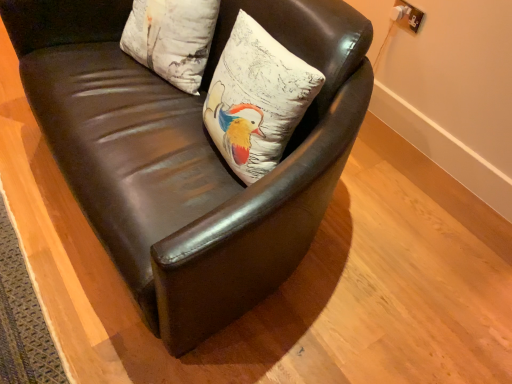
Image resolution: width=512 pixels, height=384 pixels. Describe the element at coordinates (188, 154) in the screenshot. I see `brown leather chair at center` at that location.

At what (x,y) coordinates should I click in order to perform the action: click on white matte pillow at center, the 1th pillow viewed from the right. Please return your answer as a coordinate pair (x, y). The width and height of the screenshot is (512, 384). Looking at the image, I should click on [257, 99].

Locate an element on the screen. The width and height of the screenshot is (512, 384). brown leather chair at center is located at coordinates (188, 154).

Is white matte pillow at center, which is the 2th pillow in left-to-right order, facing towards brown leather chair at center?

Yes.

Is white matte pillow at center, which is the 2th pillow in left-to-right order, inside the boundaries of brown leather chair at center, or outside?

white matte pillow at center, which is the 2th pillow in left-to-right order, is enclosed within brown leather chair at center.

From the image's perspective, is white matte pillow at center, which is the 2th pillow in left-to-right order, on brown leather chair at center?

No, from the image's perspective, white matte pillow at center, which is the 2th pillow in left-to-right order, is not above brown leather chair at center.

From a real-world perspective, relative to white textured pillow at upper center, marked as the 2th pillow in a right-to-left arrangement, is white matte pillow at center, the 1th pillow viewed from the right, vertically above or below?

Clearly, from a real-world perspective, white matte pillow at center, the 1th pillow viewed from the right, is above white textured pillow at upper center, marked as the 2th pillow in a right-to-left arrangement.

Identify the location of pillow lying in front of the white textured pillow at upper center, marked as the 2th pillow in a right-to-left arrangement. point(257,99).

Does brown leather chair at center have a greater height compared to white matte pillow at center, the 1th pillow viewed from the right?

Yes.

From the image's perspective, who appears lower, brown leather chair at center or white matte pillow at center, which is the 2th pillow in left-to-right order?

white matte pillow at center, which is the 2th pillow in left-to-right order, is shown below in the image.

Is brown leather chair at center touching white matte pillow at center, which is the 2th pillow in left-to-right order?

No, brown leather chair at center is not next to white matte pillow at center, which is the 2th pillow in left-to-right order.

Consider the image. Which object is further away from the camera taking this photo, brown leather chair at center or white matte pillow at center, which is the 2th pillow in left-to-right order?

white matte pillow at center, which is the 2th pillow in left-to-right order, is more distant.

Which is correct: white textured pillow at upper center, placed as the first pillow when sorted from left to right, is inside white matte pillow at center, which is the 2th pillow in left-to-right order, or outside of it?

white textured pillow at upper center, placed as the first pillow when sorted from left to right, is not enclosed by white matte pillow at center, which is the 2th pillow in left-to-right order.

This screenshot has height=384, width=512. I want to click on pillow behind the white matte pillow at center, which is the 2th pillow in left-to-right order, so click(172, 38).

Between white textured pillow at upper center, marked as the 2th pillow in a right-to-left arrangement, and white matte pillow at center, the 1th pillow viewed from the right, which one has smaller width?

Thinner between the two is white textured pillow at upper center, marked as the 2th pillow in a right-to-left arrangement.

Looking at this image, between white textured pillow at upper center, marked as the 2th pillow in a right-to-left arrangement, and white matte pillow at center, the 1th pillow viewed from the right, which one is positioned in front?

white matte pillow at center, the 1th pillow viewed from the right, is in front.

In the image, there is a white textured pillow at upper center, placed as the first pillow when sorted from left to right. Where is `chair below it (from the image's perspective)`? The width and height of the screenshot is (512, 384). chair below it (from the image's perspective) is located at coordinates (188, 154).

Which point is more distant from viewer, (185, 39) or (364, 25)?

Positioned behind is point (185, 39).

Who is shorter, white textured pillow at upper center, placed as the first pillow when sorted from left to right, or brown leather chair at center?

white textured pillow at upper center, placed as the first pillow when sorted from left to right.

Is brown leather chair at center oriented away from white textured pillow at upper center, placed as the first pillow when sorted from left to right?

Yes, white textured pillow at upper center, placed as the first pillow when sorted from left to right, is at the back of brown leather chair at center.

Image resolution: width=512 pixels, height=384 pixels. Identify the location of chair that is below the white textured pillow at upper center, placed as the first pillow when sorted from left to right (from the image's perspective). (188, 154).

Is brown leather chair at center outside of white textured pillow at upper center, marked as the 2th pillow in a right-to-left arrangement?

Yes, brown leather chair at center is not within white textured pillow at upper center, marked as the 2th pillow in a right-to-left arrangement.

Locate an element on the screen. The height and width of the screenshot is (384, 512). pillow on the right side of brown leather chair at center is located at coordinates (257, 99).

Where is `pillow on the left of white matte pillow at center, which is the 2th pillow in left-to-right order`? The height and width of the screenshot is (384, 512). pillow on the left of white matte pillow at center, which is the 2th pillow in left-to-right order is located at coordinates (172, 38).

Based on their spatial positions, is brown leather chair at center or white matte pillow at center, which is the 2th pillow in left-to-right order, closer to white textured pillow at upper center, placed as the first pillow when sorted from left to right?

brown leather chair at center.

Estimate the real-world distances between objects in this image. Which object is further from brown leather chair at center, white textured pillow at upper center, placed as the first pillow when sorted from left to right, or white matte pillow at center, which is the 2th pillow in left-to-right order?

Based on the image, white textured pillow at upper center, placed as the first pillow when sorted from left to right, appears to be further to brown leather chair at center.

From the image, which object appears to be nearer to white matte pillow at center, which is the 2th pillow in left-to-right order, brown leather chair at center or white textured pillow at upper center, placed as the first pillow when sorted from left to right?

Among the two, brown leather chair at center is located nearer to white matte pillow at center, which is the 2th pillow in left-to-right order.

In the scene shown: Considering their positions, is white matte pillow at center, which is the 2th pillow in left-to-right order, positioned further to brown leather chair at center than white textured pillow at upper center, placed as the first pillow when sorted from left to right?

The object further to brown leather chair at center is white textured pillow at upper center, placed as the first pillow when sorted from left to right.

Which object lies nearer to the anchor point white matte pillow at center, which is the 2th pillow in left-to-right order, white textured pillow at upper center, marked as the 2th pillow in a right-to-left arrangement, or brown leather chair at center?

brown leather chair at center lies closer to white matte pillow at center, which is the 2th pillow in left-to-right order, than the other object.

When comparing their distances from white textured pillow at upper center, placed as the first pillow when sorted from left to right, does white matte pillow at center, the 1th pillow viewed from the right, or brown leather chair at center seem further?

Among the two, white matte pillow at center, the 1th pillow viewed from the right, is located further to white textured pillow at upper center, placed as the first pillow when sorted from left to right.

Locate an element on the screen. This screenshot has width=512, height=384. pillow positioned between brown leather chair at center and white textured pillow at upper center, marked as the 2th pillow in a right-to-left arrangement, from near to far is located at coordinates (257, 99).